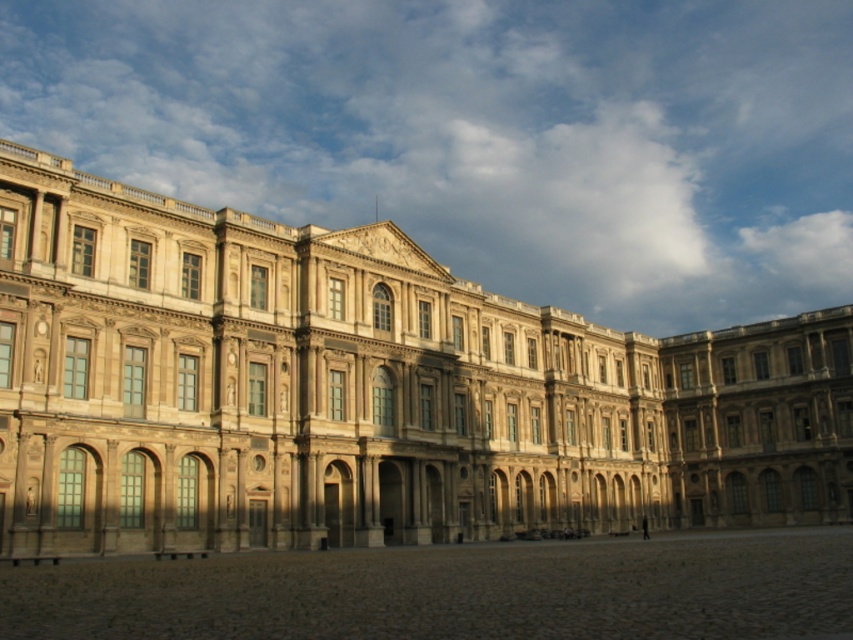
You are standing in front of the grand classical building and notice two points marked on the facade. The first point is at coordinates point [405,524] and the second is at point [453,588]. Which point is closer to your current position?

Point [405,524] is further to the camera than point [453,588], so the point closer to your current position is point [453,588].

You are standing in the brown stone courtyard at lower center and want to enter the beige stone palace at center. Which direction should you look to see the entrance of the palace?

The beige stone palace at center is located above the brown stone courtyard at lower center, so you should look upward to see the entrance of the palace.

You are an architect designing a new garden layout for the beige stone palace at center and the brown stone courtyard at lower center. Based on their widths, which structure should you prioritize for expansion to maintain symmetry with the existing building design?

The beige stone palace at center has a greater width than the brown stone courtyard at lower center. To maintain symmetry, the brown stone courtyard at lower center should be prioritized for expansion to match the palace width.